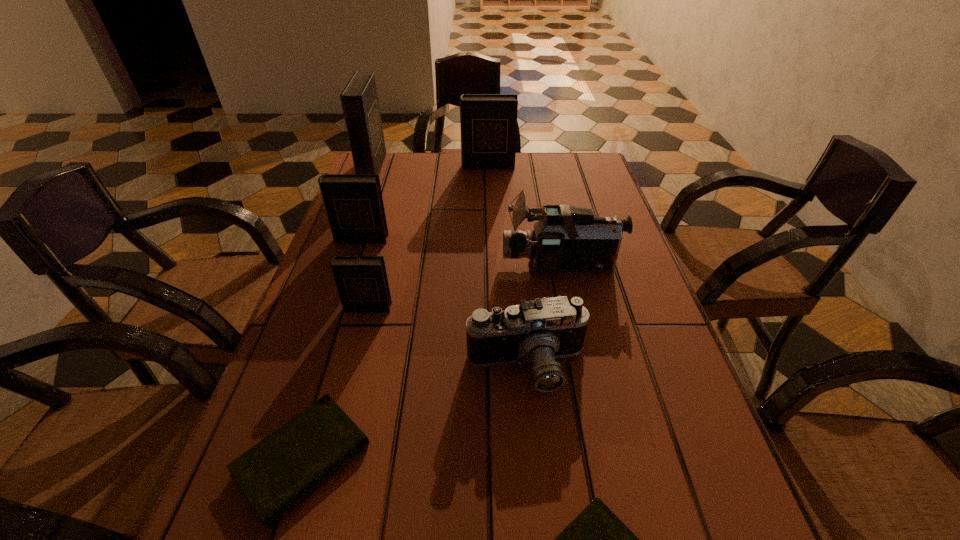
Where is `the second shortest object`? The width and height of the screenshot is (960, 540). the second shortest object is located at coordinates (278, 472).

Identify the location of the second shortest diary. This screenshot has width=960, height=540. (278, 472).

The height and width of the screenshot is (540, 960). What are the coordinates of `free space located on the front cover of the biggest dark diary` in the screenshot? It's located at (468, 168).

The width and height of the screenshot is (960, 540). Find the location of `free space located on the front cover of the second tallest diary`. free space located on the front cover of the second tallest diary is located at coordinates (490, 236).

Where is `blank space located 0.320m on the front-facing side of the fourth farthest object`? blank space located 0.320m on the front-facing side of the fourth farthest object is located at coordinates (372, 264).

Where is `free space located 0.310m on the front-facing side of the fourth farthest object`? free space located 0.310m on the front-facing side of the fourth farthest object is located at coordinates pos(376,264).

You are a GUI agent. You are given a task and a screenshot of the screen. Output one action in this format:
    pyautogui.click(x=<x>, y=<y>)
    Task: Click on the vacant space located 0.200m on the front-facing side of the fourth farthest object
    The width and height of the screenshot is (960, 540).
    Given the screenshot: What is the action you would take?
    pyautogui.click(x=421, y=264)

Where is `vacant space located 0.280m on the front cover of the third tallest diary`? Image resolution: width=960 pixels, height=540 pixels. vacant space located 0.280m on the front cover of the third tallest diary is located at coordinates (333, 325).

You are a GUI agent. You are given a task and a screenshot of the screen. Output one action in this format:
    pyautogui.click(x=<x>, y=<y>)
    Task: Click on the free space located 0.050m on the front cover of the third nearest diary
    The width and height of the screenshot is (960, 540).
    Given the screenshot: What is the action you would take?
    pyautogui.click(x=362, y=330)

Identify the location of vacant space situated at the lens of the camera. (533, 433).